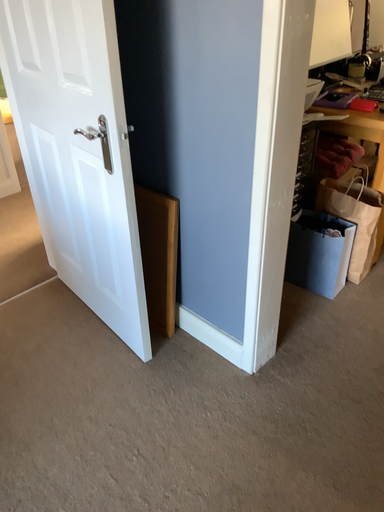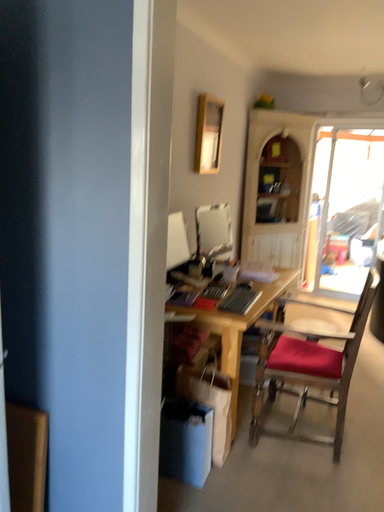
Question: How did the camera likely rotate when shooting the video?

Choices:
 (A) rotated upward
 (B) rotated downward

Answer: (A)